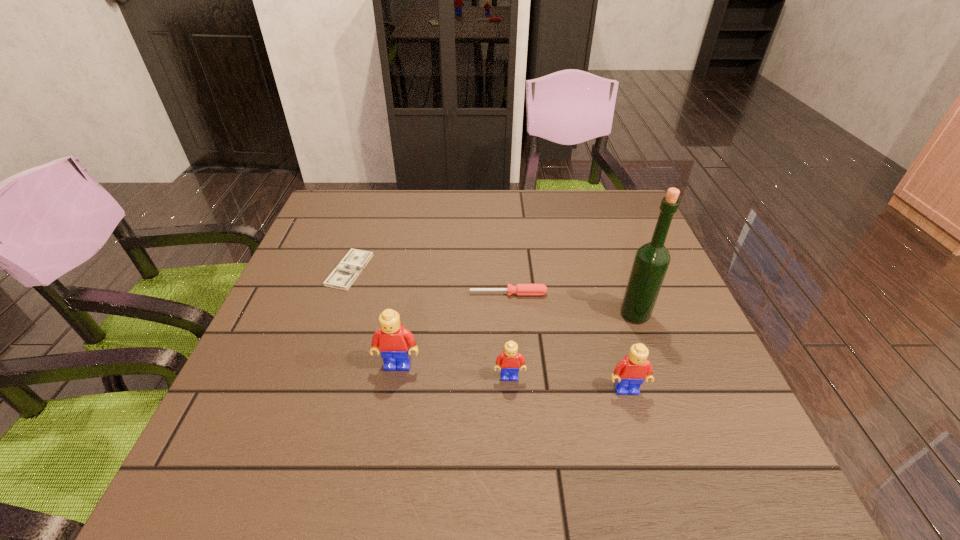
What are the coordinates of `the second tallest object` in the screenshot? It's located at (394, 342).

You are a GUI agent. You are given a task and a screenshot of the screen. Output one action in this format:
    pyautogui.click(x=<x>, y=<y>)
    Task: Click on the fifth object from right to left
    
    Given the screenshot: What is the action you would take?
    pyautogui.click(x=394, y=342)

Find the location of a particular element. the shortest Lego is located at coordinates (508, 363).

Identify the location of the third shortest object. This screenshot has height=540, width=960. (508, 363).

Locate an element on the screen. the nearest object is located at coordinates (630, 372).

Where is `the rightmost Lego`? The width and height of the screenshot is (960, 540). the rightmost Lego is located at coordinates (630, 372).

In order to click on liquor in this screenshot , I will do `click(652, 259)`.

Where is `the tallest object`? The image size is (960, 540). the tallest object is located at coordinates (652, 259).

Identify the location of the shortest object. The image size is (960, 540). (342, 277).

Locate an element on the screen. The image size is (960, 540). dollar is located at coordinates (342, 277).